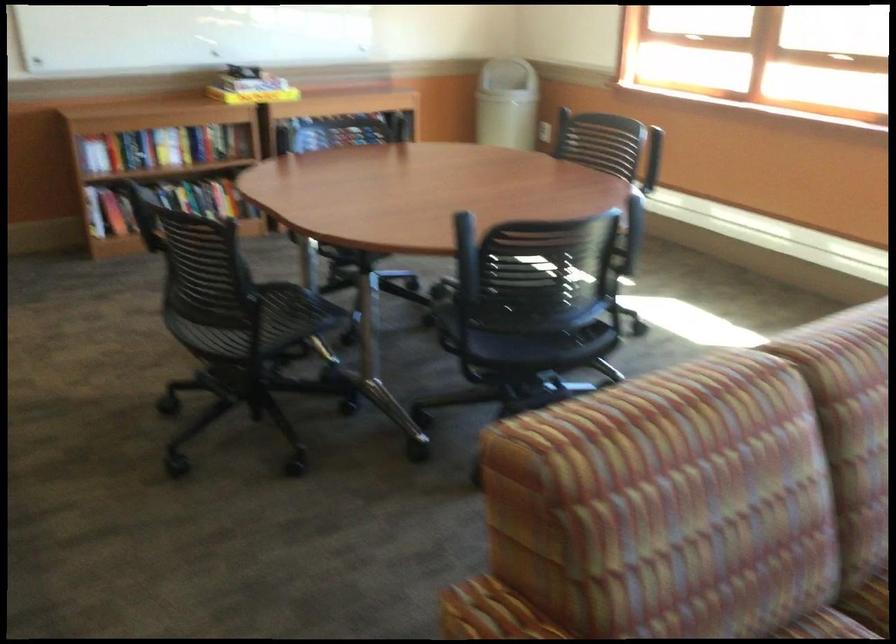
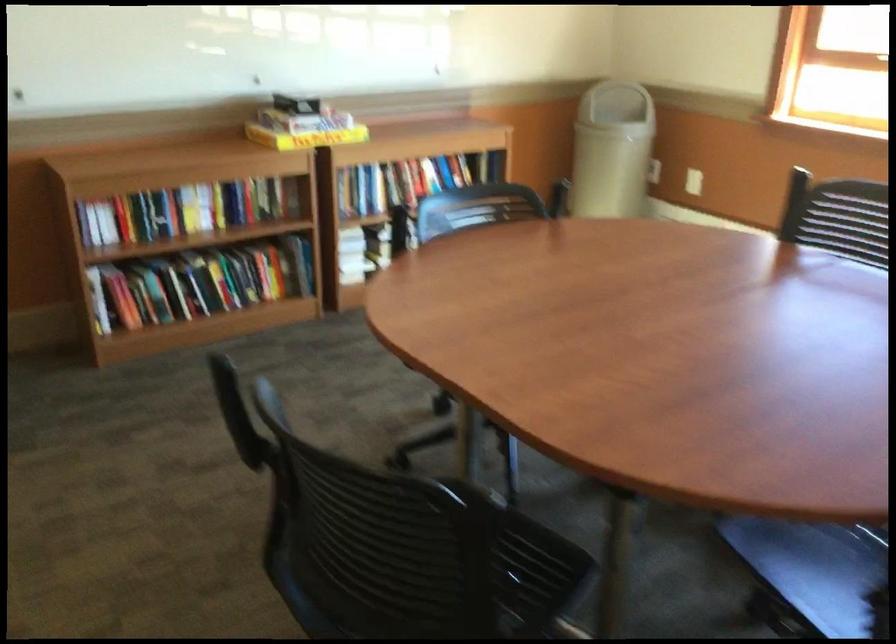
What movement of the cameraman would produce the second image?

The movement direction of the cameraman is left, forward.